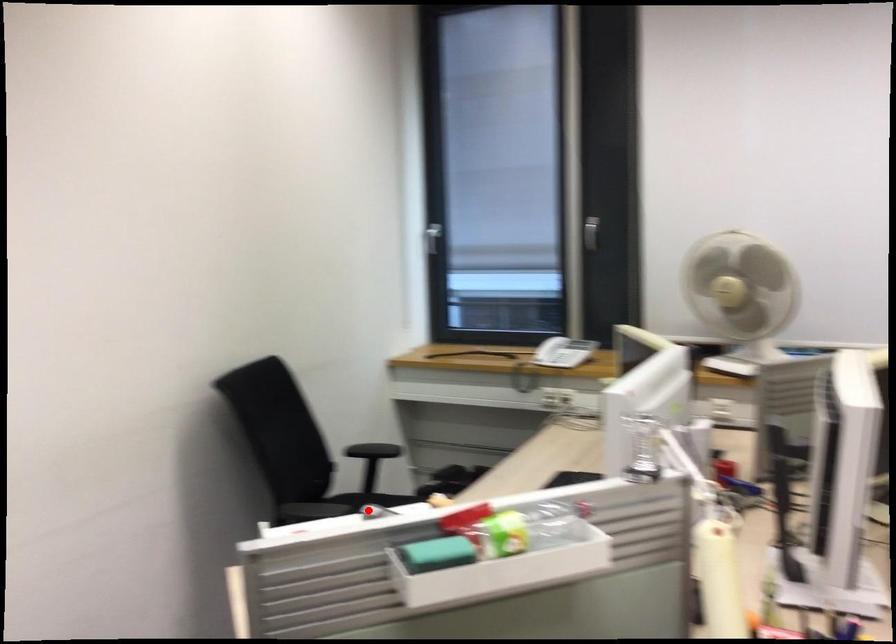
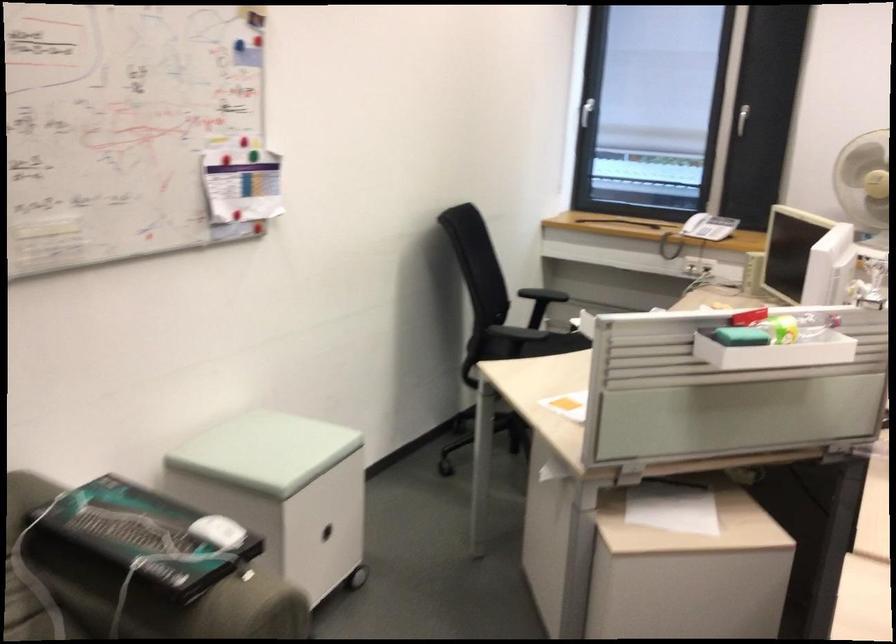
Question: I am providing you with two images of the same scene from different viewpoints. A red point is marked on the first image. At the location where the point appears in image 1, is it still visible in image 2?

Choices:
 (A) Yes
 (B) No

Answer: (B)